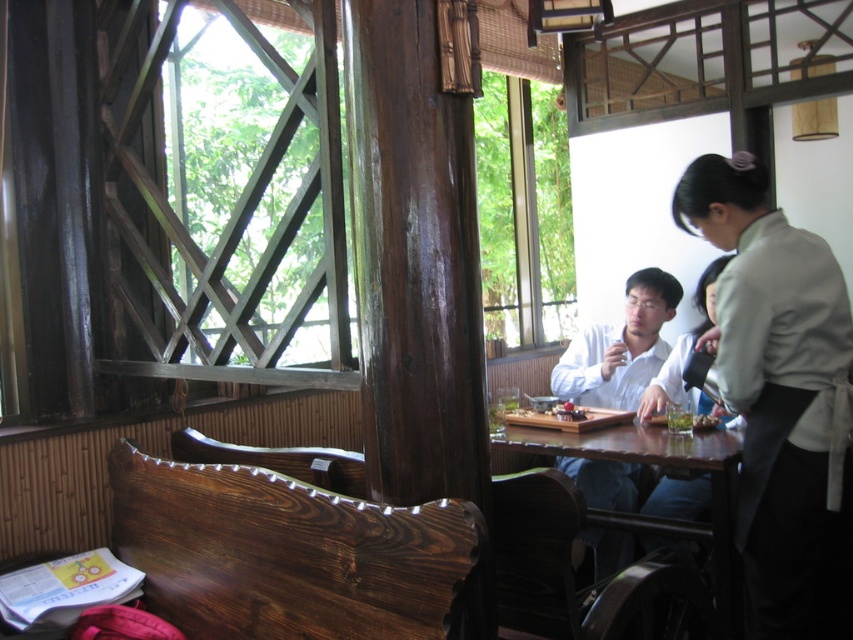
Who is lower down, brown wooden table at center or green leafy vegetables at table?

brown wooden table at center

Who is higher up, brown wooden table at center or green leafy vegetables at table?

green leafy vegetables at table is higher up.

I want to click on brown wooden table at center, so click(668, 468).

Locate an element on the screen. Image resolution: width=853 pixels, height=640 pixels. brown wooden table at center is located at coordinates (668, 468).

Is light beige fabric apron at right to the left of white glossy shirt at center from the viewer's perspective?

In fact, light beige fabric apron at right is to the right of white glossy shirt at center.

Can you confirm if light beige fabric apron at right is bigger than white glossy shirt at center?

Yes, light beige fabric apron at right is bigger than white glossy shirt at center.

The image size is (853, 640). I want to click on light beige fabric apron at right, so click(780, 397).

Locate an element on the screen. Image resolution: width=853 pixels, height=640 pixels. light beige fabric apron at right is located at coordinates (780, 397).

Does light beige fabric apron at right appear on the left side of brown wooden table at center?

No, light beige fabric apron at right is not to the left of brown wooden table at center.

Looking at this image, can you confirm if light beige fabric apron at right is wider than brown wooden table at center?

Incorrect, light beige fabric apron at right's width does not surpass brown wooden table at center's.

Measure the distance between light beige fabric apron at right and camera.

light beige fabric apron at right is 6.27 feet away from camera.

This screenshot has width=853, height=640. Identify the location of light beige fabric apron at right. (780, 397).